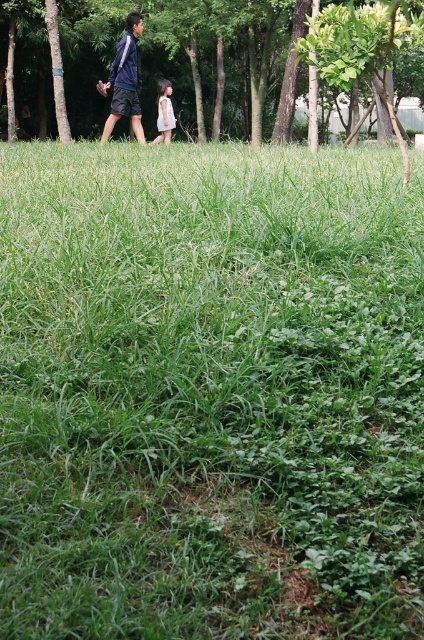
Question: Which of these objects is positioned farthest from the blue fabric jacket at upper left?

Choices:
 (A) green leafy tree at upper center
 (B) light pink fabric dress at center

Answer: (A)

Question: Which point is closer to the camera?

Choices:
 (A) (162, 97)
 (B) (83, 29)
 (C) (122, 80)

Answer: (C)

Question: Can you confirm if green leafy tree at upper center is wider than light pink fabric dress at center?

Choices:
 (A) yes
 (B) no

Answer: (B)

Question: Does blue fabric jacket at upper left appear on the left side of light pink fabric dress at center?

Choices:
 (A) no
 (B) yes

Answer: (B)

Question: Which point is closer to the camera taking this photo?

Choices:
 (A) (164, 104)
 (B) (25, 51)

Answer: (A)

Question: Observing the image, what is the correct spatial positioning of green leafy tree at upper center in reference to light pink fabric dress at center?

Choices:
 (A) right
 (B) left

Answer: (B)